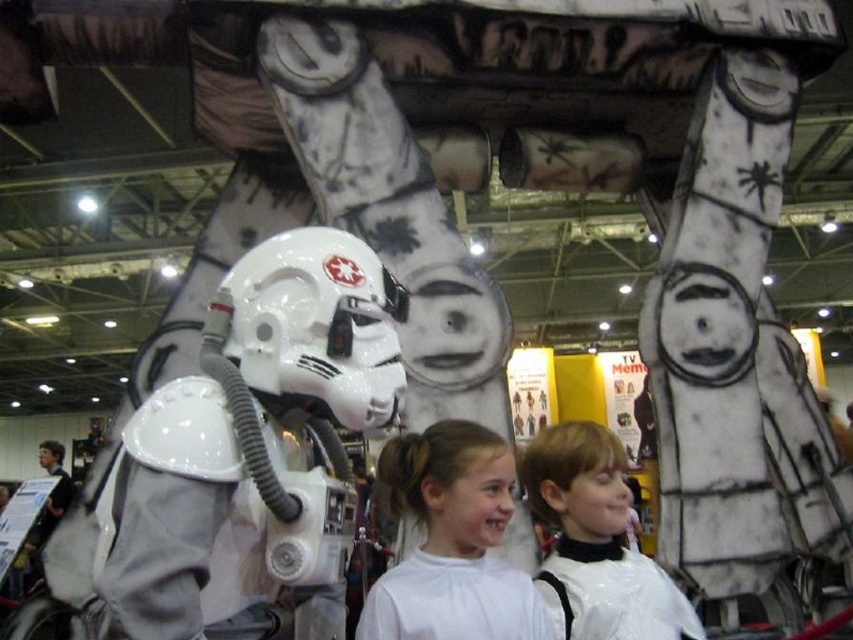
This screenshot has height=640, width=853. Identify the location of white matte shirt at center. (451, 541).

Who is positioned more to the right, white matte shirt at center or white glossy hair at center?

From the viewer's perspective, white glossy hair at center appears more on the right side.

Does point (476, 499) come in front of point (614, 490)?

Yes, point (476, 499) is in front of point (614, 490).

Locate an element on the screen. This screenshot has width=853, height=640. white matte shirt at center is located at coordinates (451, 541).